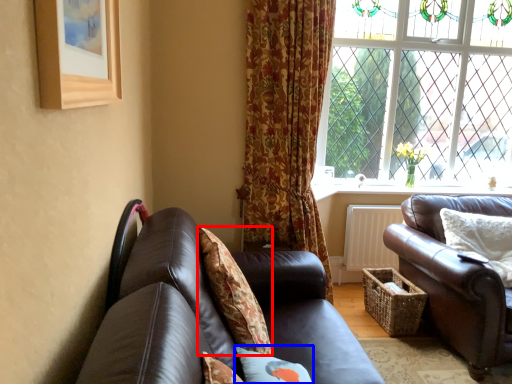
Question: Among these objects, which one is farthest to the camera, pillow (highlighted by a red box) or pillow (highlighted by a blue box)?

Choices:
 (A) pillow
 (B) pillow

Answer: (A)